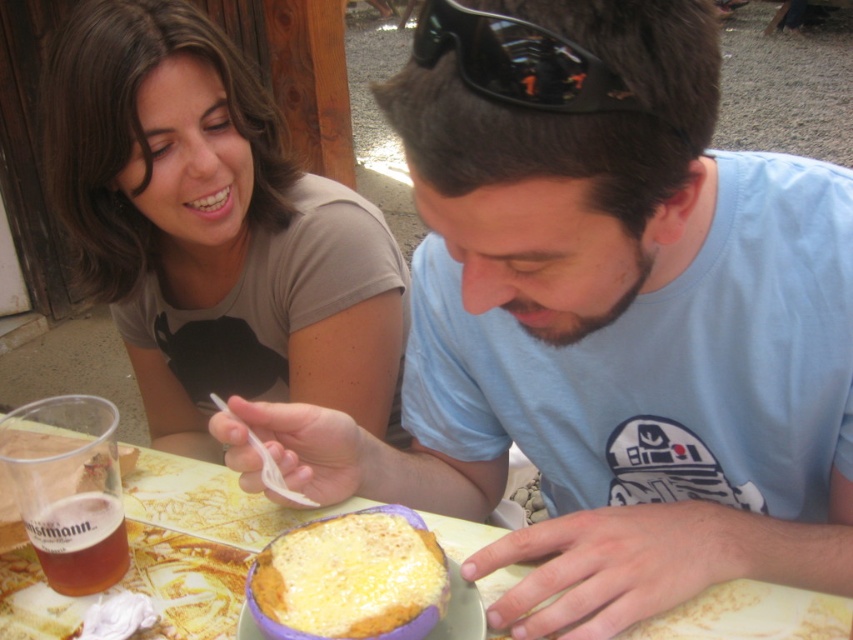
You are a food delivery person who needs to place a hot dish on the wooden table at center and the golden cheese bread at center. However, the delivery area is limited. Can you fit both items on the table without overlapping them?

The wooden table at center is to the right of golden cheese bread at center, so they are already positioned on the table. Since they are both at the center, there might not be enough space to place both items without overlapping. Check the table size before placing.

You are a photographer trying to capture a closeup of the golden cheese bread at center without including the translucent plastic cup at lower left in the frame. Is it possible to do so based on their positions?

The golden cheese bread at center is positioned over the translucent plastic cup at lower left, so it is possible to capture a closeup of the golden cheese bread at center without including the cup by adjusting the camera angle to focus on the bread while avoiding the cup beneath it.

You are standing at the center of the image. There is a point at coordinates (213, 228). What object is located at that point?

The point at coordinates (213, 228) is occupied by the matte brown shirt at upper left.